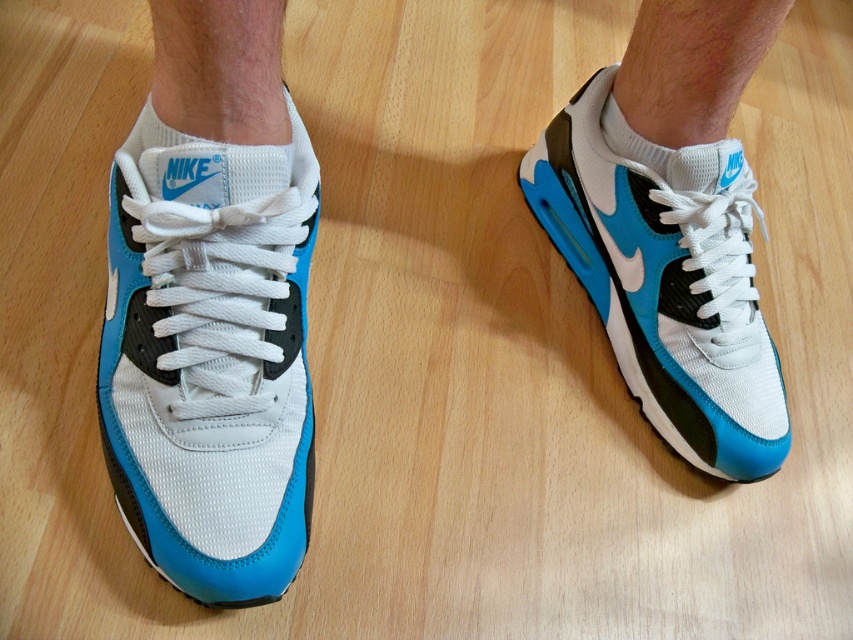
Question: Is white mesh shoe at center above matte mesh shoe at center?

Choices:
 (A) no
 (B) yes

Answer: (A)

Question: Does white mesh shoe at center have a larger size compared to matte mesh shoe at center?

Choices:
 (A) yes
 (B) no

Answer: (B)

Question: Can you confirm if white mesh shoe at center is thinner than matte mesh shoe at center?

Choices:
 (A) no
 (B) yes

Answer: (B)

Question: Which point is farther from the camera taking this photo?

Choices:
 (A) (639, 218)
 (B) (248, 483)

Answer: (A)

Question: Which point is closer to the camera taking this photo?

Choices:
 (A) (199, 512)
 (B) (593, 300)

Answer: (A)